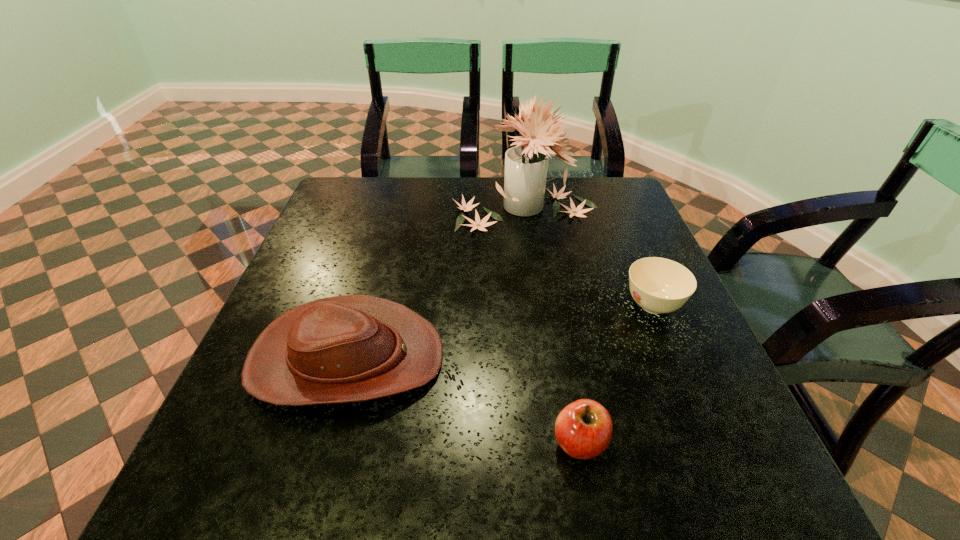
Point out which object is positioned as the second nearest to the sugar bowl. Please provide its 2D coordinates. Your answer should be formatted as a tuple, i.e. [(x, y)], where the tuple contains the x and y coordinates of a point satisfying the conditions above.

[(583, 429)]

Locate an element on the screen. This screenshot has height=540, width=960. object that is the third closest to the cowboy hat is located at coordinates (658, 285).

Locate an element on the screen. The height and width of the screenshot is (540, 960). vacant space that satisfies the following two spatial constraints: 1. on the front-facing side of the apple; 2. on the right side of the cowboy hat is located at coordinates point(323,442).

The height and width of the screenshot is (540, 960). What are the coordinates of `vacant area that satisfies the following two spatial constraints: 1. on the front side of the tallest object; 2. on the left side of the sugar bowl` in the screenshot? It's located at (537, 306).

Find the location of `vacant space that satisfies the following two spatial constraints: 1. on the back side of the sugar bowl; 2. on the left side of the apple`. vacant space that satisfies the following two spatial constraints: 1. on the back side of the sugar bowl; 2. on the left side of the apple is located at coordinates (555, 306).

Locate an element on the screen. vacant region that satisfies the following two spatial constraints: 1. on the front-facing side of the apple; 2. on the left side of the cowboy hat is located at coordinates (323, 442).